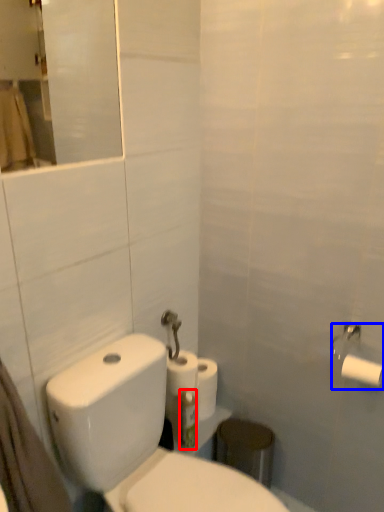
Question: Which of the following is the farthest to the observer, toothbrush (highlighted by a red box) or toilet paper (highlighted by a blue box)?

Choices:
 (A) toothbrush
 (B) toilet paper

Answer: (A)